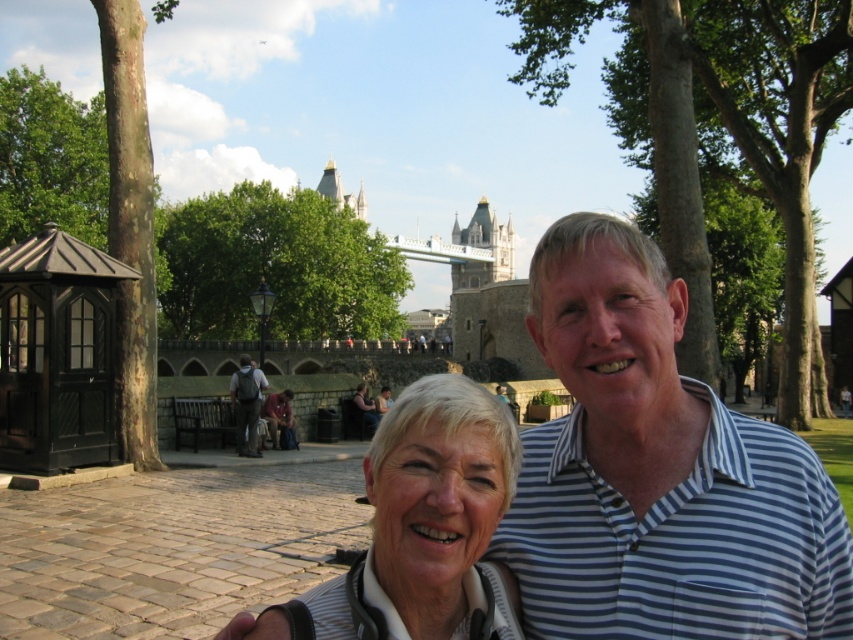
Question: Which of the following is the closest to the observer?

Choices:
 (A) (369, 410)
 (B) (252, 433)
 (C) (114, 310)

Answer: (C)

Question: Is blue striped shirt at center positioned behind dark gray backpack at center?

Choices:
 (A) yes
 (B) no

Answer: (B)

Question: Does white matte hair at center appear under black wood gazebo at left?

Choices:
 (A) yes
 (B) no

Answer: (A)

Question: Which object is positioned closest to the blonde hair at center?

Choices:
 (A) black wood gazebo at left
 (B) white matte hair at center
 (C) dark gray backpack at center
 (D) blue striped shirt at center

Answer: (C)

Question: Which is nearer to the white matte hair at center?

Choices:
 (A) dark gray backpack at center
 (B) black wood gazebo at left
 (C) blue striped shirt at center

Answer: (C)

Question: Can you confirm if white matte hair at center is bigger than dark gray backpack at center?

Choices:
 (A) no
 (B) yes

Answer: (B)